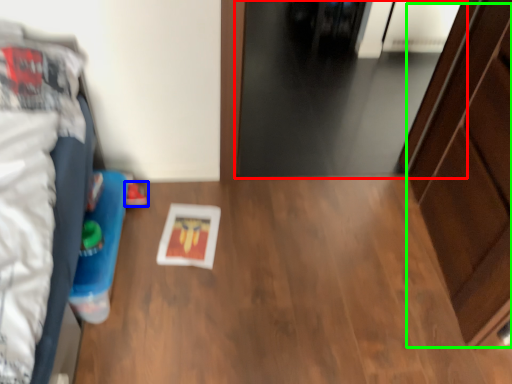
Question: Considering the real-world distances, which object is farthest from door (highlighted by a red box)? footwear (highlighted by a blue box) or dresser (highlighted by a green box)?

Choices:
 (A) footwear
 (B) dresser

Answer: (A)